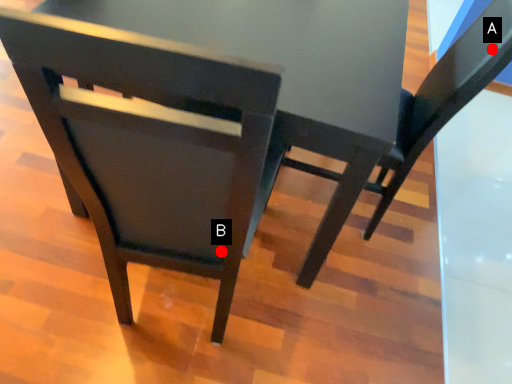
Question: Two points are circled on the image, labeled by A and B beside each circle. Which of the following is the farthest from the observer?

Choices:
 (A) A is further
 (B) B is further

Answer: (A)